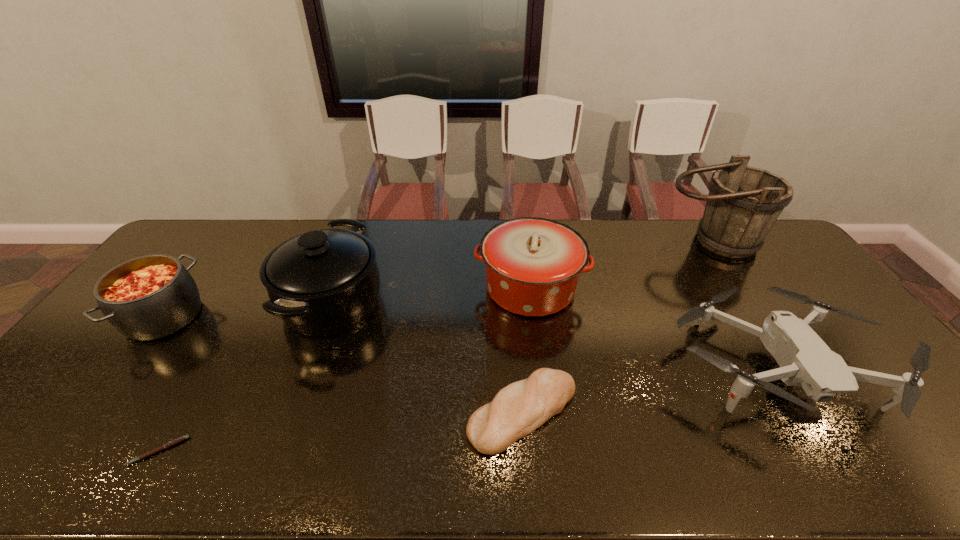
Find the location of a particular element. The image size is (960, 540). vacant space that is in between the bucket and the second shortest object is located at coordinates (616, 327).

You are a GUI agent. You are given a task and a screenshot of the screen. Output one action in this format:
    pyautogui.click(x=<x>, y=<y>)
    Task: Click on the object that is the third closest one to the second shortest object
    The image size is (960, 540).
    Given the screenshot: What is the action you would take?
    pyautogui.click(x=324, y=282)

Locate which object is the sixth closest to the leftmost object. Please provide its 2D coordinates. Your answer should be formatted as a tuple, i.e. [(x, y)], where the tuple contains the x and y coordinates of a point satisfying the conditions above.

[(743, 204)]

Find the location of a particular element. The width and height of the screenshot is (960, 540). free space that satisfies the following two spatial constraints: 1. on the back side of the fifth shortest object; 2. on the right side of the bread is located at coordinates (513, 288).

You are a GUI agent. You are given a task and a screenshot of the screen. Output one action in this format:
    pyautogui.click(x=<x>, y=<y>)
    Task: Click on the free space in the image that satisfies the following two spatial constraints: 1. on the front side of the saucepan; 2. on the right side of the bread
    The width and height of the screenshot is (960, 540).
    Given the screenshot: What is the action you would take?
    pyautogui.click(x=291, y=413)